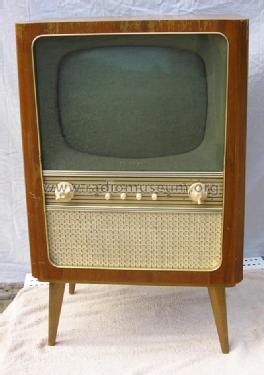
Where is `tv bezel`? Image resolution: width=264 pixels, height=375 pixels. tv bezel is located at coordinates coord(212,47).